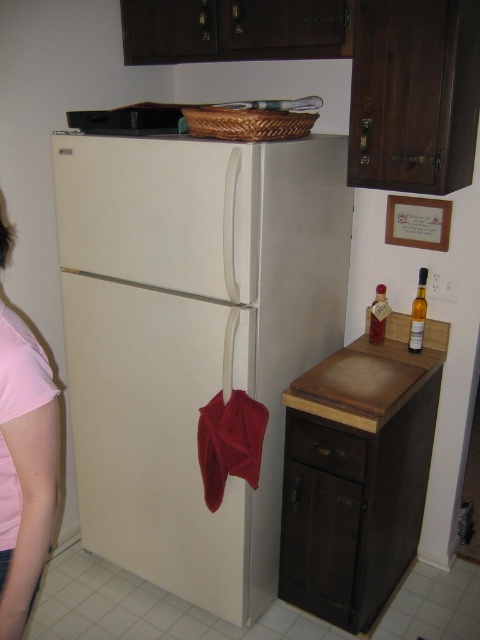
Question: Which is nearer to the pink fabric shirt at left?

Choices:
 (A) yellow glass bottle at right
 (B) brown wood drawer at lower center
 (C) white matte refrigerator at center
 (D) woven brown basket at upper center

Answer: (C)

Question: Does white matte refrigerator at center appear over pink fabric shirt at left?

Choices:
 (A) yes
 (B) no

Answer: (A)

Question: Considering the real-world distances, which object is farthest from the translucent glass bottle at right?

Choices:
 (A) brown wood drawer at lower center
 (B) yellow glass bottle at right
 (C) woven brown basket at upper center
 (D) white matte refrigerator at center

Answer: (C)

Question: From the image, what is the correct spatial relationship of pink fabric shirt at left in relation to brown wood drawer at lower center?

Choices:
 (A) below
 (B) above

Answer: (B)

Question: Which object is closer to the camera taking this photo?

Choices:
 (A) translucent glass bottle at right
 (B) yellow glass bottle at right
 (C) woven brown basket at upper center

Answer: (C)

Question: Is white matte refrigerator at center to the right of pink fabric shirt at left from the viewer's perspective?

Choices:
 (A) no
 (B) yes

Answer: (B)